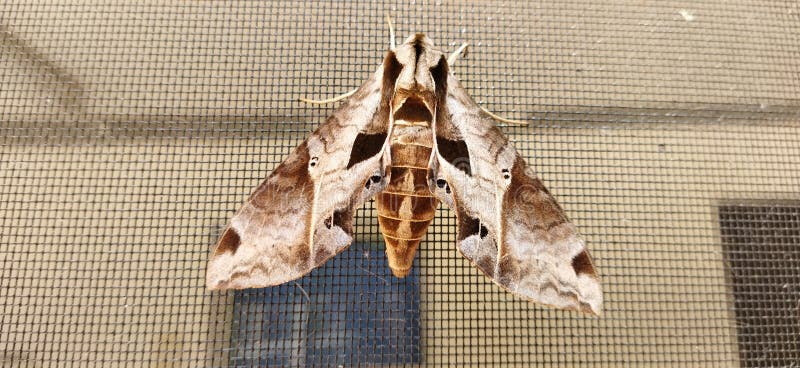
Where is `white frame`? This screenshot has height=368, width=800. white frame is located at coordinates (289, 361).